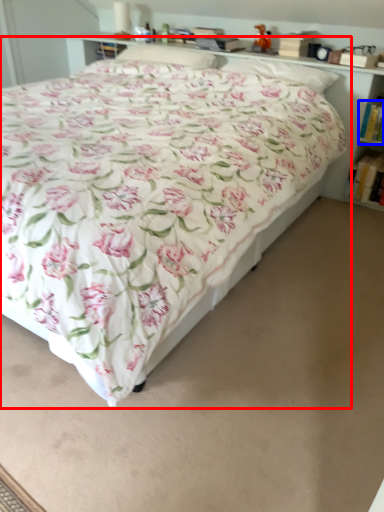
Question: Which of the following is the closest to the observer, bed (highlighted by a red box) or book (highlighted by a blue box)?

Choices:
 (A) bed
 (B) book

Answer: (A)